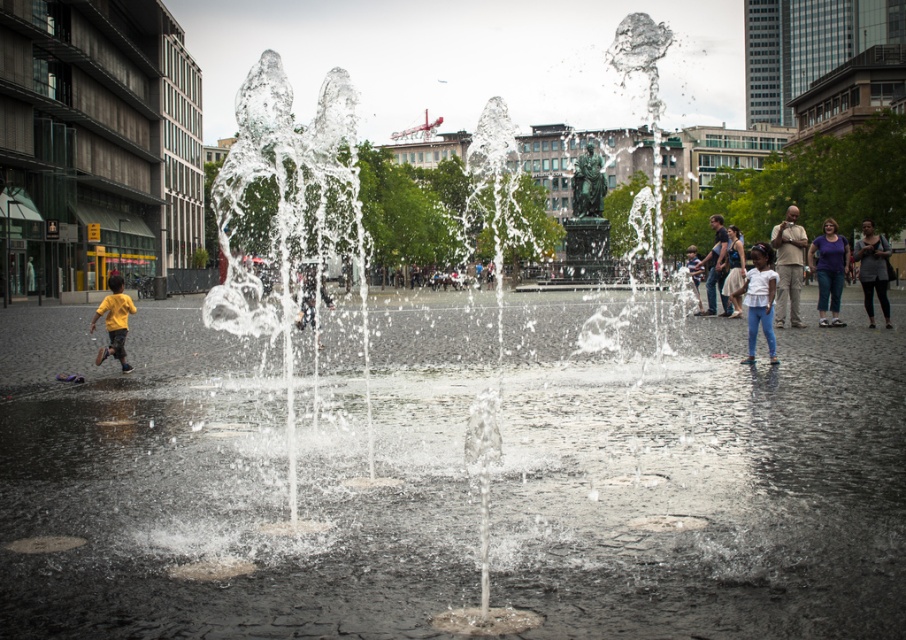
You are a photographer trying to capture a photo of the water fountain. You notice two people in the scene, one wearing tan khaki pants at right and another wearing light blue jeans at center. Since you want to focus on the fountain, which person should you ask to move further back so their pants don

The tan khaki pants at right has a larger size compared to light blue jeans at center. Therefore, you should ask the person wearing the tan khaki pants at right to move further back to ensure the fountain remains the main focus of the photo.